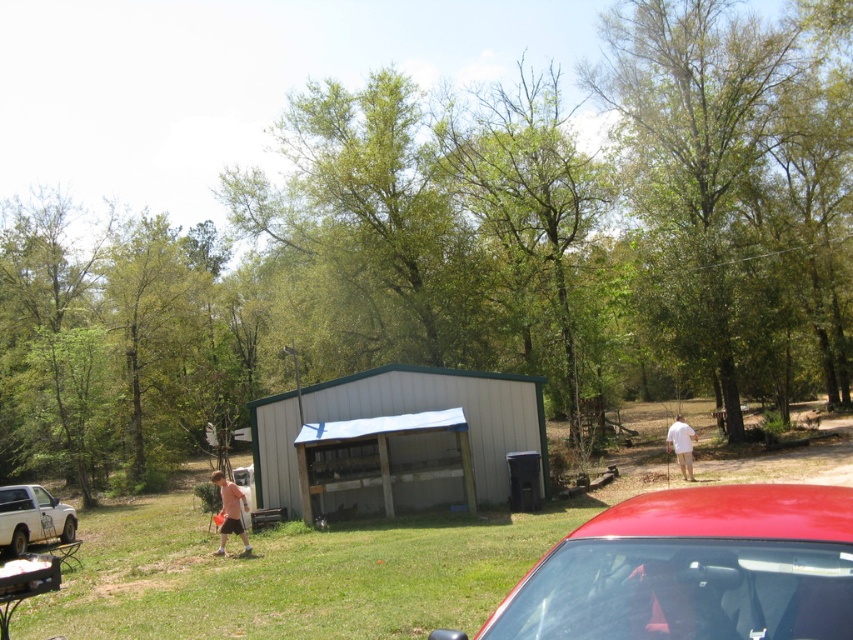
Does shiny red car at lower right have a smaller size compared to white matte truck at lower left?

Correct, shiny red car at lower right occupies less space than white matte truck at lower left.

Describe the element at coordinates (694, 570) in the screenshot. I see `shiny red car at lower right` at that location.

Who is more distant from viewer, (x=560, y=596) or (x=39, y=504)?

Point (x=39, y=504)

This screenshot has height=640, width=853. Find the location of `shiny red car at lower right`. shiny red car at lower right is located at coordinates pos(694,570).

Can you confirm if shiny red car at lower right is bigger than white cotton shirt at center-right?

No.

Between shiny red car at lower right and white cotton shirt at center-right, which one has more height?

Standing taller between the two is white cotton shirt at center-right.

Between point (666, 637) and point (674, 451), which one is positioned in front?

Point (666, 637)

Identify the location of shiny red car at lower right. (694, 570).

Is white matte truck at lower left below matte pink shorts at center?

Correct, white matte truck at lower left is located below matte pink shorts at center.

Which is below, white matte truck at lower left or matte pink shorts at center?

white matte truck at lower left is below.

The image size is (853, 640). I want to click on white matte truck at lower left, so click(x=32, y=518).